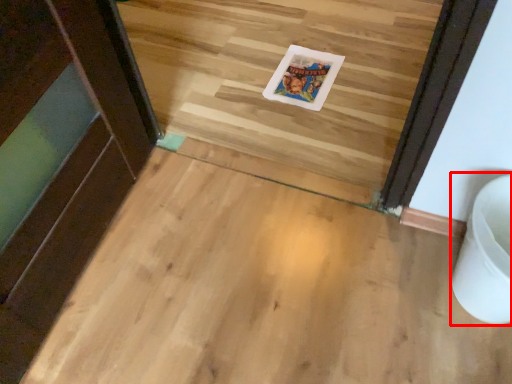
Question: From the image, what is the correct spatial relationship of toilet bowl (annotated by the red box) in relation to postcard?

Choices:
 (A) left
 (B) right

Answer: (B)